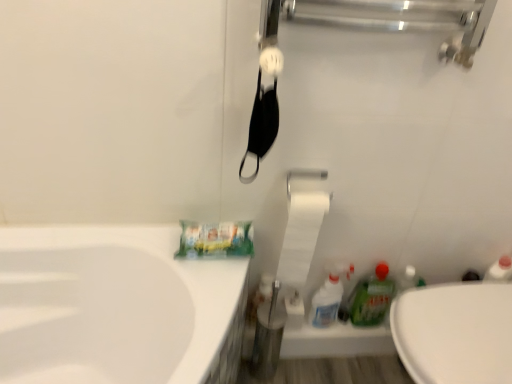
The width and height of the screenshot is (512, 384). Find the location of `vacant area on top of white glossy toilet at lower right (from a real-world perspective)`. vacant area on top of white glossy toilet at lower right (from a real-world perspective) is located at coordinates (466, 326).